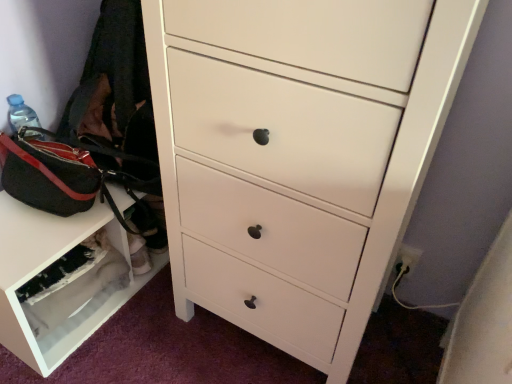
Find the location of a particular element. The height and width of the screenshot is (384, 512). vacant space to the right of white matte shoe rack at lower left is located at coordinates [150, 329].